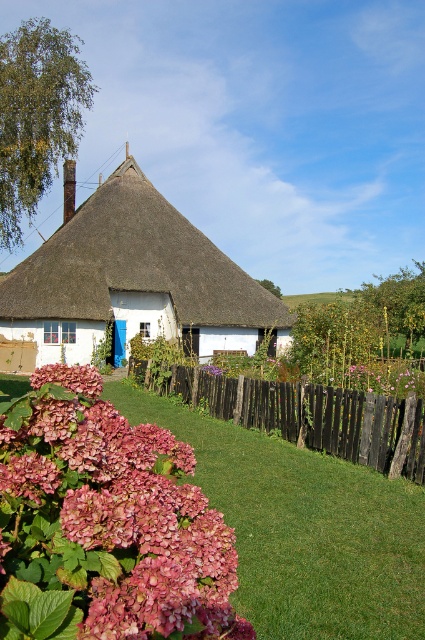
Is pink matte hydrangea at lower left thinner than black wooden fence at lower center?

Indeed, pink matte hydrangea at lower left has a lesser width compared to black wooden fence at lower center.

Is point (110, 474) behind point (297, 442)?

No.

You are a GUI agent. You are given a task and a screenshot of the screen. Output one action in this format:
    pyautogui.click(x=<x>, y=<y>)
    Task: Click on the pink matte hydrangea at lower left
    The image size is (425, 640).
    Given the screenshot: What is the action you would take?
    pyautogui.click(x=108, y=518)

Does pink matte hydrangea at lower left come behind white thatched roof at center?

No, pink matte hydrangea at lower left is in front of white thatched roof at center.

Is point (25, 465) more distant than point (93, 336)?

That is False.

Image resolution: width=425 pixels, height=640 pixels. What are the coordinates of `pink matte hydrangea at lower left` in the screenshot? It's located at (108, 518).

Between white thatched roof at center and black wooden fence at lower center, which one has more height?

Standing taller between the two is white thatched roof at center.

Where is `white thatched roof at center`? This screenshot has width=425, height=640. white thatched roof at center is located at coordinates (135, 282).

The image size is (425, 640). I want to click on white thatched roof at center, so click(x=135, y=282).